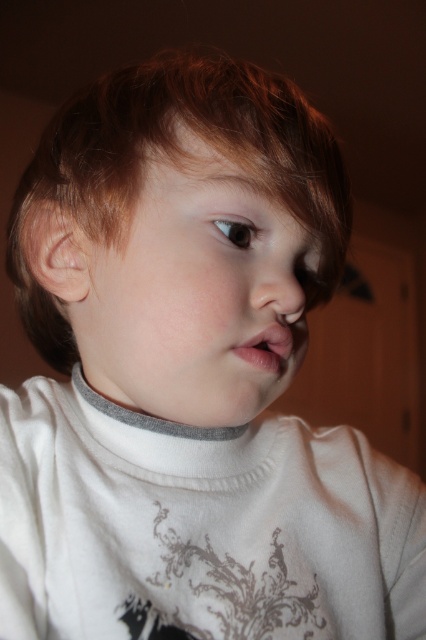
Who is higher up, smooth skin face at center or pink glossy lips at center?

smooth skin face at center

Is smooth skin face at center further to the viewer compared to pink glossy lips at center?

No, smooth skin face at center is in front of pink glossy lips at center.

Identify the location of smooth skin face at center. The image size is (426, 640). (192, 289).